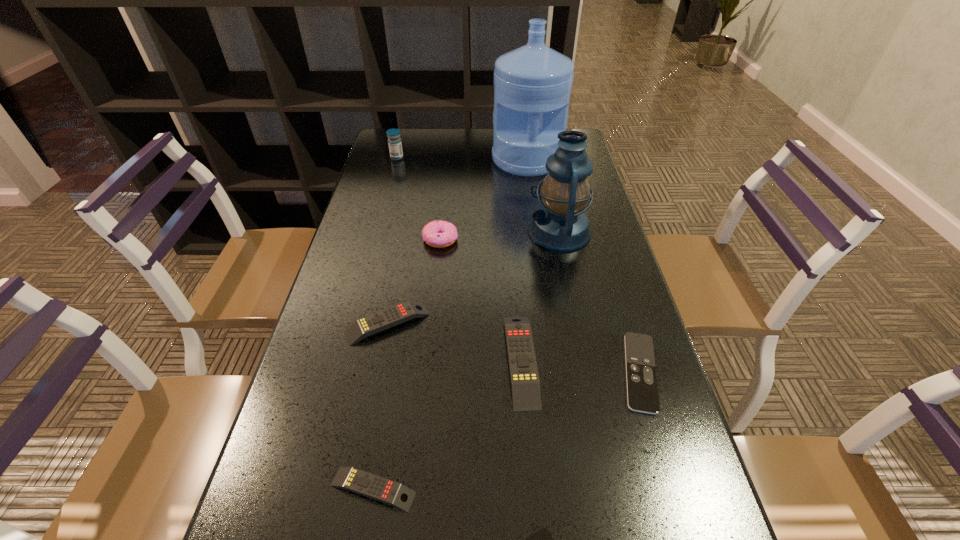
At what (x,y) coordinates should I click in order to perform the action: click on vacant space situated 0.250m on the right of the third tallest object. Please return your answer as a coordinate pair (x, y). Image resolution: width=960 pixels, height=540 pixels. Looking at the image, I should click on coord(475,158).

This screenshot has width=960, height=540. I want to click on blank space located on the right of the doughnut, so click(x=494, y=239).

Identify the location of free space located 0.080m on the back of the biggest yellow remote control. click(x=516, y=292).

Where is `vacant area located 0.370m on the front of the second tallest remote control`? vacant area located 0.370m on the front of the second tallest remote control is located at coordinates (347, 535).

This screenshot has height=540, width=960. Find the location of `vacant point located on the right of the smallest yellow remote control`. vacant point located on the right of the smallest yellow remote control is located at coordinates (535, 489).

The image size is (960, 540). I want to click on vacant point located 0.100m on the left of the rightmost remote control, so click(x=570, y=372).

Locate an element on the screen. The width and height of the screenshot is (960, 540). water jug present at the far edge is located at coordinates (532, 84).

Image resolution: width=960 pixels, height=540 pixels. Find the location of `medicine that is positioned at the far edge`. medicine that is positioned at the far edge is located at coordinates (394, 141).

At what (x,y) coordinates should I click in order to perform the action: click on medicine located at the left edge. Please return your answer as a coordinate pair (x, y). This screenshot has height=540, width=960. Looking at the image, I should click on (394, 141).

Find the location of a particular element. The image size is (960, 540). water jug that is at the right edge is located at coordinates (532, 84).